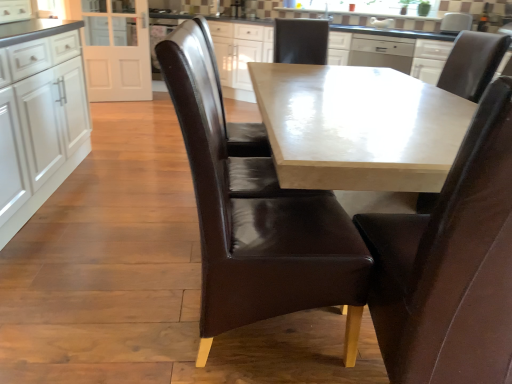
This screenshot has height=384, width=512. I want to click on empty space that is ontop of white glossy sink at upper center, so click(322, 1).